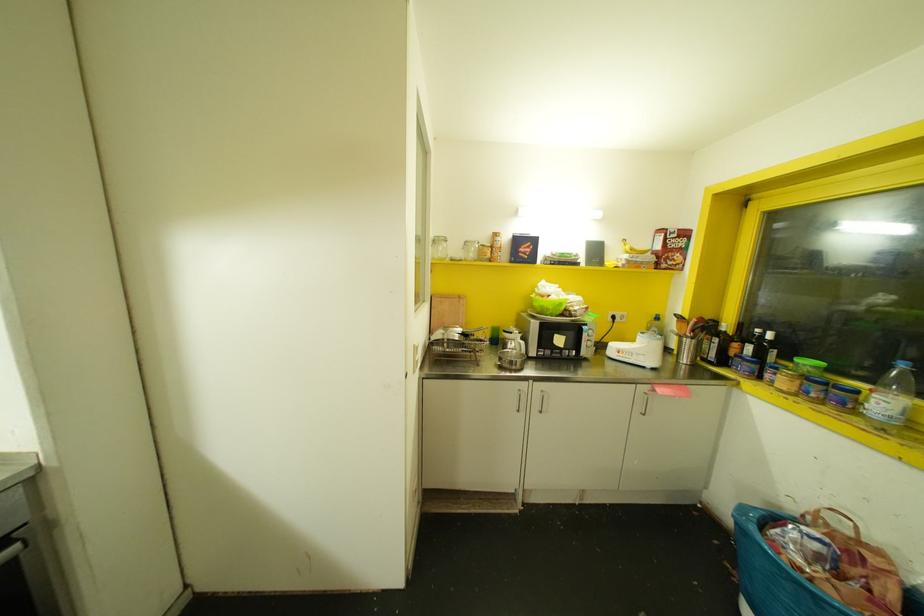
Identify the location of glass carafe handle. (514, 361).